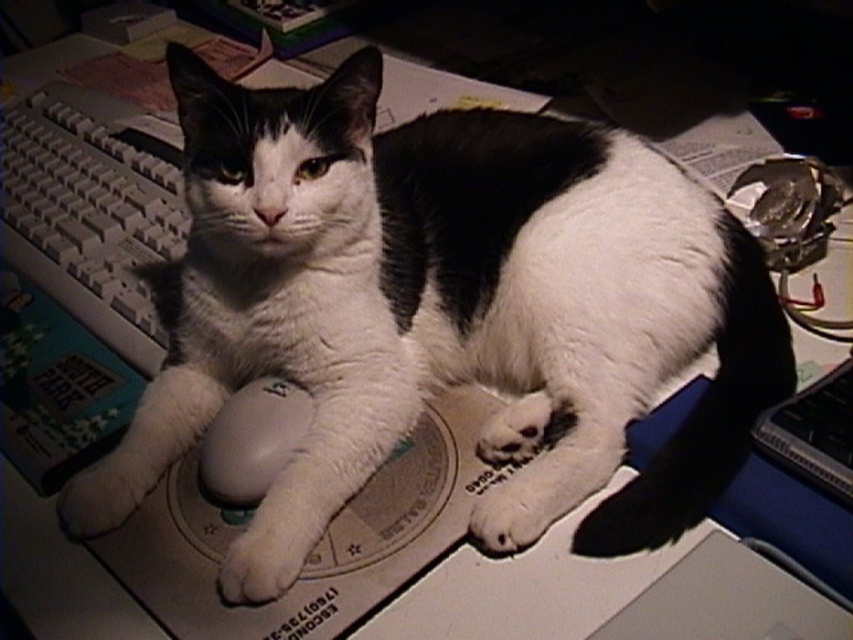
Question: Does white plastic keyboard at left appear on the right side of white matte mouse at center?

Choices:
 (A) no
 (B) yes

Answer: (A)

Question: Where is white plastic keyboard at left located in relation to white matte mouse at center in the image?

Choices:
 (A) left
 (B) right

Answer: (A)

Question: Which object appears farthest from the camera in this image?

Choices:
 (A) white matte mouse at center
 (B) white plastic keyboard at left

Answer: (B)

Question: Does white plastic keyboard at left come in front of white matte mouse at center?

Choices:
 (A) yes
 (B) no

Answer: (B)